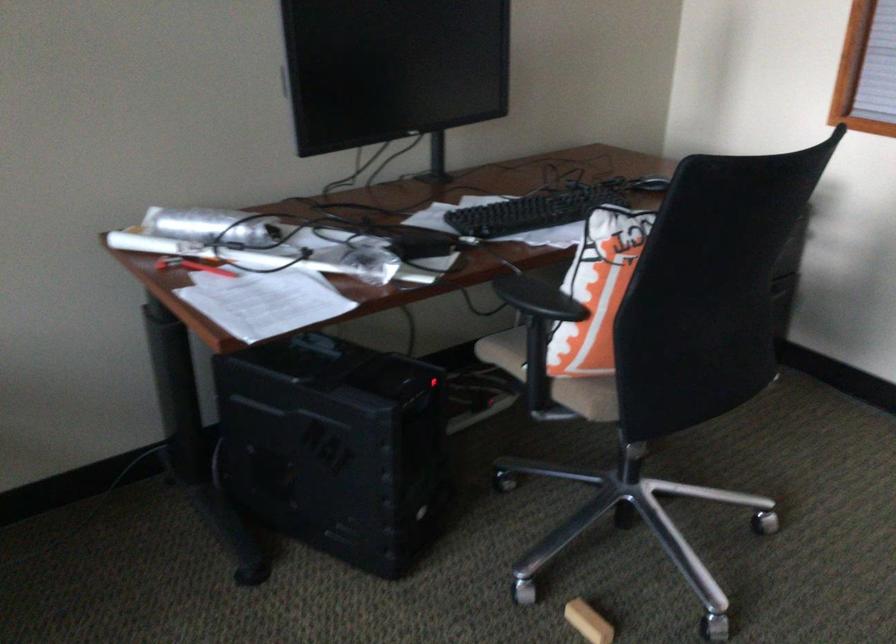
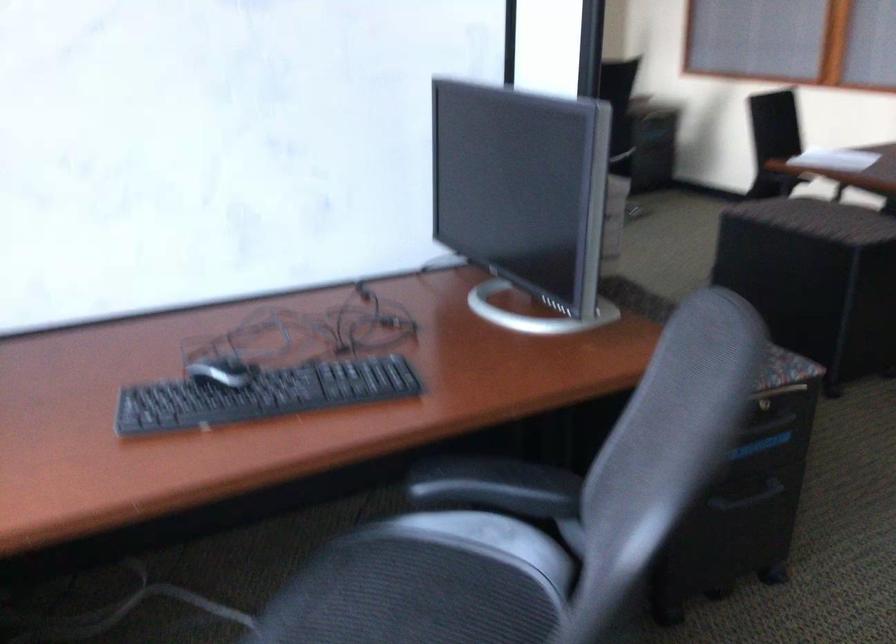
Question: I am providing you with two images of the same scene from different viewpoints. Which of the following objects are not visible in image2?

Choices:
 (A) red utility knife
 (B) green-capped spice jar
 (C) chair sitting surface
 (D) computer mouse

Answer: (A)